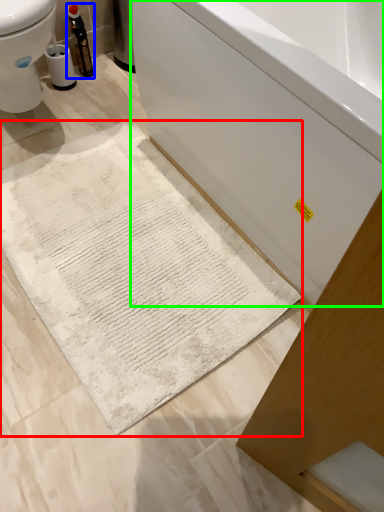
Question: Which is nearer to the bath mat (highlighted by a red box)? bottle (highlighted by a blue box) or bathtub (highlighted by a green box).

Choices:
 (A) bottle
 (B) bathtub

Answer: (B)